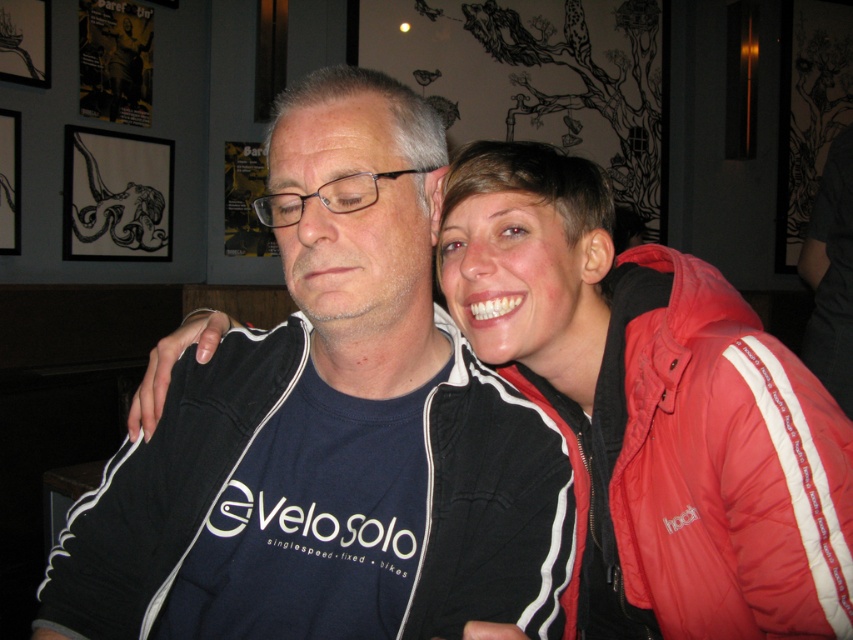
You are a photographer trying to capture a group photo of two people wearing jackets. You see the black matte jacket at center and the red puffy jacket at right. Which jacket is positioned closer to the left side of the frame?

The black matte jacket at center is positioned closer to the left side of the frame because it is to the left of the red puffy jacket at right.

You are standing in the indoor setting where the man and woman are. There is a point at coordinates (329, 429). What object is located at that point?

The point at coordinates (329, 429) corresponds to the black matte jacket at center.

You are standing in the scene and want to reach both the point at (175, 589) and the point at (732, 493). Which point will you physically reach first?

You will physically reach point (175, 589) first because it is closer to you than point (732, 493).